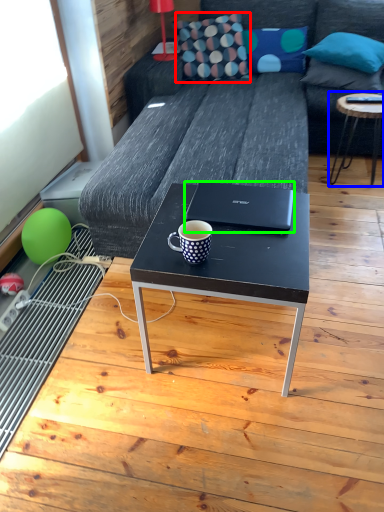
Question: Estimate the real-world distances between objects in this image. Which object is farther from throw pillow (highlighted by a red box), table (highlighted by a blue box) or laptop (highlighted by a green box)?

Choices:
 (A) table
 (B) laptop

Answer: (B)